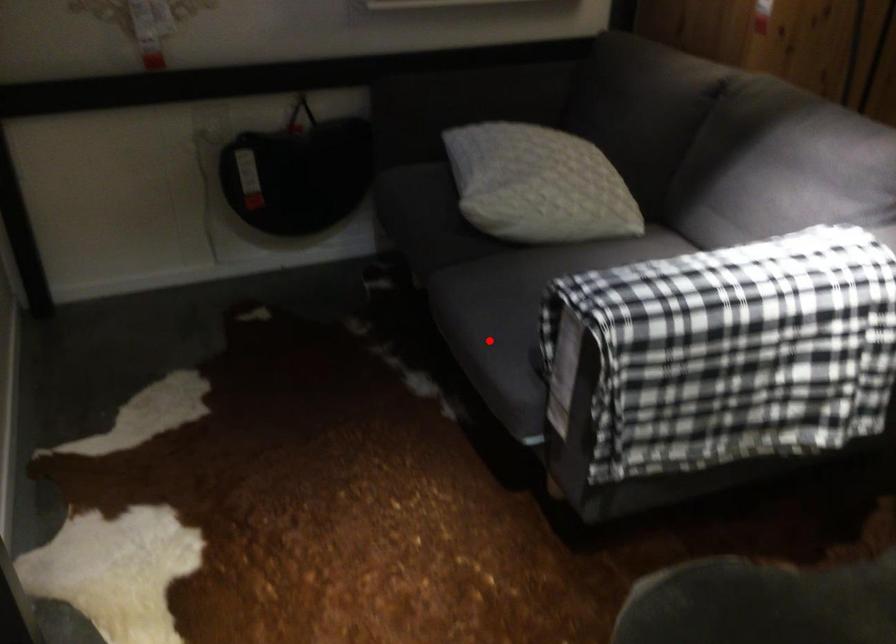
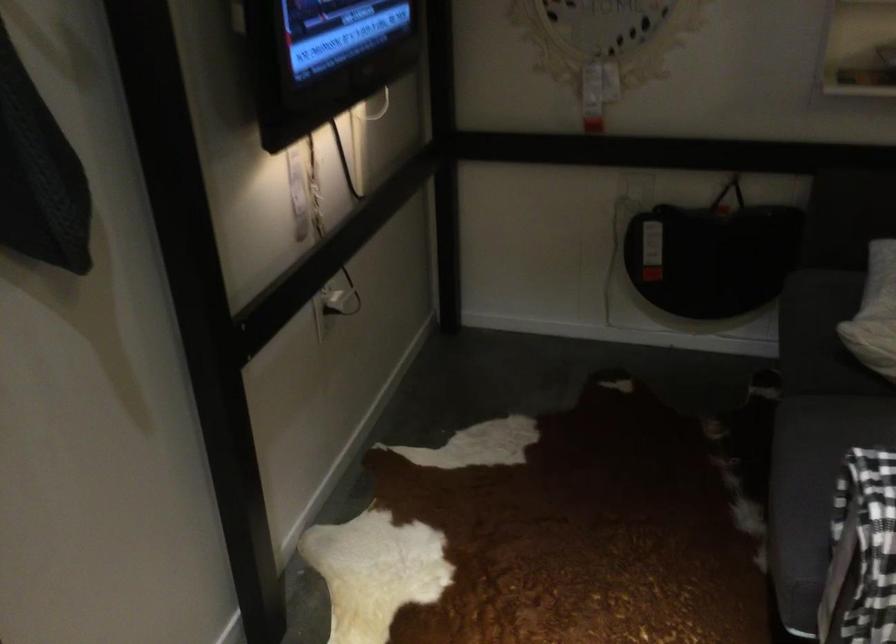
Question: I am providing you with two images of the same scene from different viewpoints. Given a red point in image1, look at the same physical point in image2. Is it:

Choices:
 (A) Closer to the viewpoint
 (B) Farther from the viewpoint

Answer: (A)